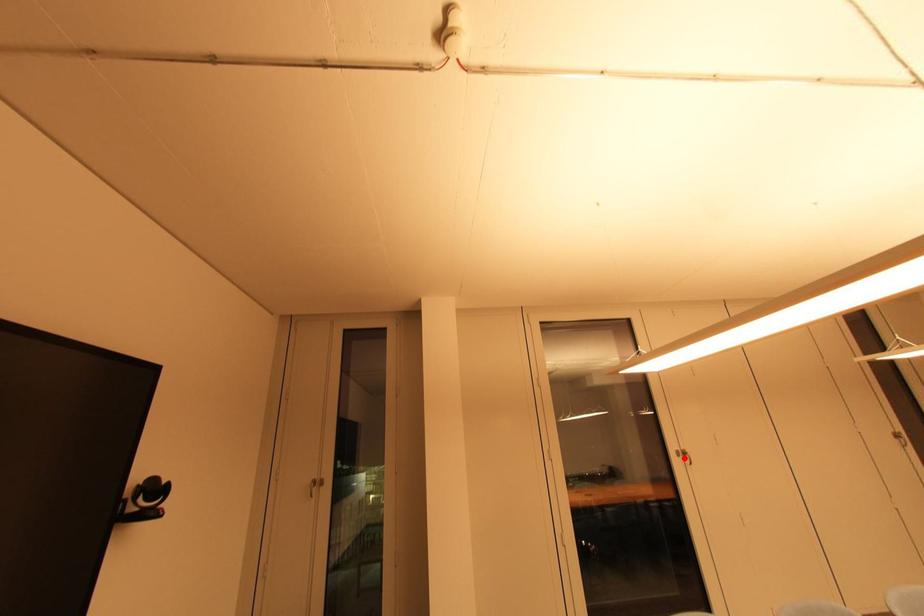
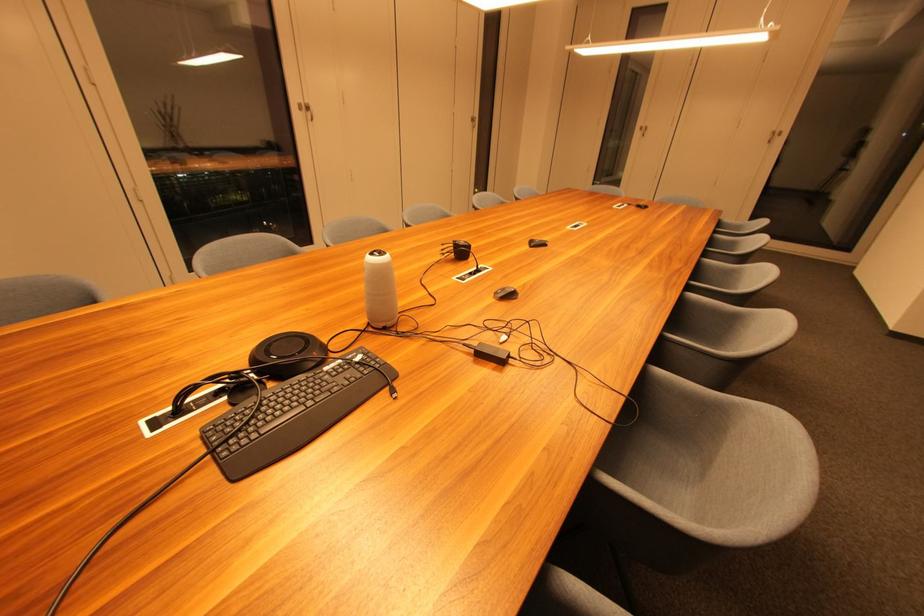
Where in the second image is the point corresponding to the highlighted location from the first image?

(306, 111)